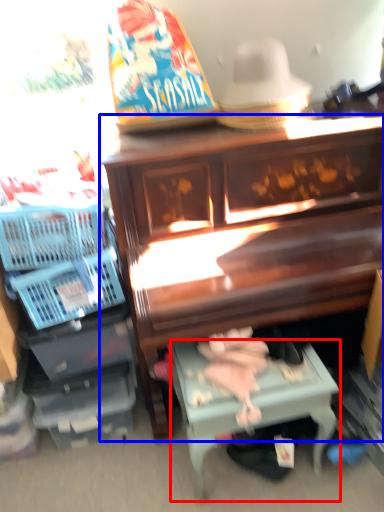
Question: Among these objects, which one is farthest to the camera, table (highlighted by a red box) or furniture (highlighted by a blue box)?

Choices:
 (A) table
 (B) furniture

Answer: (A)